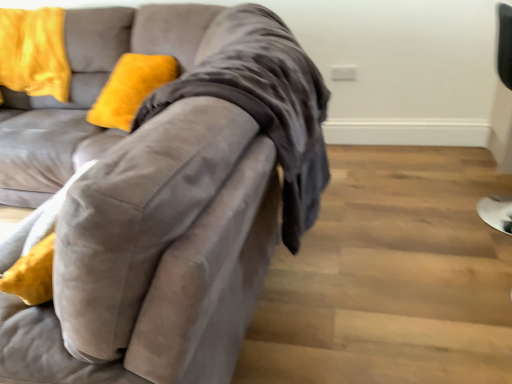
You are a GUI agent. You are given a task and a screenshot of the screen. Output one action in this format:
    pyautogui.click(x=<x>, y=<y>)
    Task: Click on the velvet yellow pillow at upper left
    
    Given the screenshot: What is the action you would take?
    pyautogui.click(x=34, y=52)

Based on their positions, is velvet yellow pillow at upper left located to the left or right of black leather chair at right?

Based on their positions, velvet yellow pillow at upper left is located to the left of black leather chair at right.

Who is smaller, velvet yellow pillow at upper left or black leather chair at right?

Smaller between the two is velvet yellow pillow at upper left.

Consider the image. Is velvet yellow pillow at upper left oriented towards black leather chair at right?

No.

Consider the image. Considering the relative sizes of velvet gray couch at left and black leather chair at right in the image provided, is velvet gray couch at left smaller than black leather chair at right?

Actually, velvet gray couch at left might be larger than black leather chair at right.

Does velvet gray couch at left lie behind black leather chair at right?

No.

Is black leather chair at right spatially inside velvet gray couch at left, or outside of it?

black leather chair at right is located beyond the bounds of velvet gray couch at left.

Can you see black leather chair at right touching velvet gray couch at left?

black leather chair at right and velvet gray couch at left are not in contact.

From the image's perspective, is black leather chair at right above velvet gray couch at left?

Yes, from the image's perspective, black leather chair at right is above velvet gray couch at left.

Is black leather chair at right taller or shorter than velvet gray couch at left?

In the image, black leather chair at right appears to be shorter than velvet gray couch at left.

Considering their positions, is velvet yellow pillow at upper left located in front of or behind velvet gray couch at left?

In the image, velvet yellow pillow at upper left appears behind velvet gray couch at left.

From the image's perspective, which object appears higher, velvet yellow pillow at upper left or velvet gray couch at left?

velvet yellow pillow at upper left appears higher in the image.

Does point (26, 71) come closer to viewer compared to point (229, 304)?

No, (26, 71) is further to viewer.

Looking at this image, in the image, is velvet gray couch at left on the left side or the right side of velvet yellow pillow at upper left?

velvet gray couch at left is to the right of velvet yellow pillow at upper left.

Considering the points (222, 43) and (37, 47), which point is behind, point (222, 43) or point (37, 47)?

The point (37, 47) is behind.

From the image's perspective, is velvet gray couch at left located above velvet yellow pillow at upper left?

No.

Does velvet gray couch at left have a larger size compared to velvet yellow pillow at upper left?

Correct, velvet gray couch at left is larger in size than velvet yellow pillow at upper left.

Consider the image. Is black leather chair at right beside velvet yellow pillow at upper left?

black leather chair at right and velvet yellow pillow at upper left are clearly separated.

Is point (510, 133) positioned before point (44, 74)?

That is True.

The width and height of the screenshot is (512, 384). Identify the location of computer chair that appears on the right of velvet yellow pillow at upper left. (504, 44).

Find the location of `computer chair below the velvet gray couch at left (from a real-world perspective)`. computer chair below the velvet gray couch at left (from a real-world perspective) is located at coordinates (504, 44).

Which object lies further to the anchor point black leather chair at right, velvet yellow pillow at upper left or velvet gray couch at left?

Based on the image, velvet yellow pillow at upper left appears to be further to black leather chair at right.

Which object lies further to the anchor point velvet yellow pillow at upper left, black leather chair at right or velvet gray couch at left?

black leather chair at right.

Which object lies nearer to the anchor point velvet yellow pillow at upper left, velvet gray couch at left or black leather chair at right?

velvet gray couch at left lies closer to velvet yellow pillow at upper left than the other object.

From the picture: From the image, which object appears to be nearer to velvet gray couch at left, black leather chair at right or velvet yellow pillow at upper left?

velvet yellow pillow at upper left lies closer to velvet gray couch at left than the other object.

Which object lies nearer to the anchor point black leather chair at right, velvet gray couch at left or velvet yellow pillow at upper left?

velvet gray couch at left is positioned closer to the anchor black leather chair at right.

Looking at the image, which one is located further to velvet gray couch at left, velvet yellow pillow at upper left or black leather chair at right?

black leather chair at right.

Locate an element on the screen. Image resolution: width=512 pixels, height=384 pixels. studio couch located between velvet yellow pillow at upper left and black leather chair at right in the left-right direction is located at coordinates (164, 194).